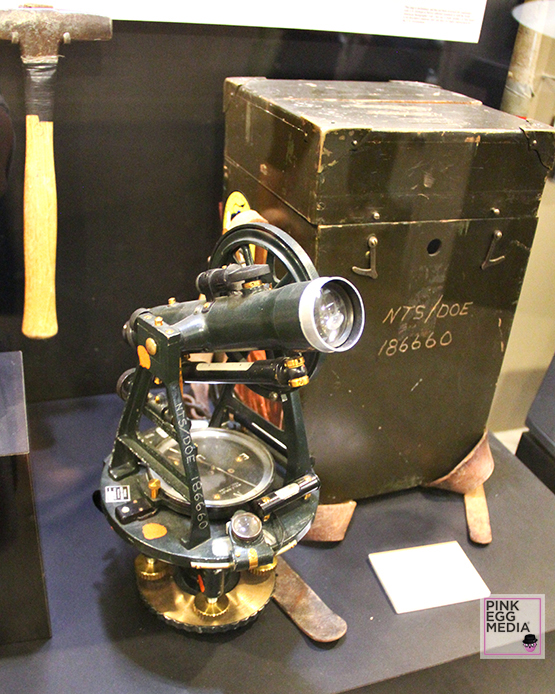
The height and width of the screenshot is (694, 555). What are the coordinates of `metal frame` in the screenshot? It's located at (410, 446).